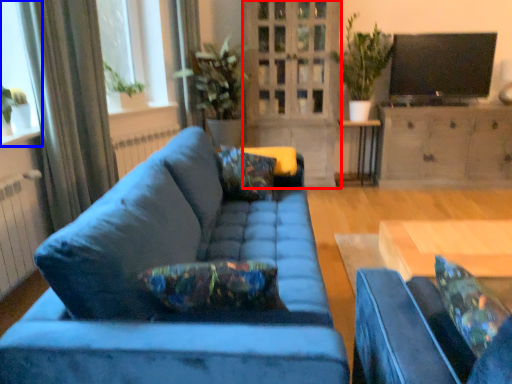
Question: Which object appears closest to the camera in this image, glass door (highlighted by a red box) or window (highlighted by a blue box)?

Choices:
 (A) glass door
 (B) window

Answer: (B)